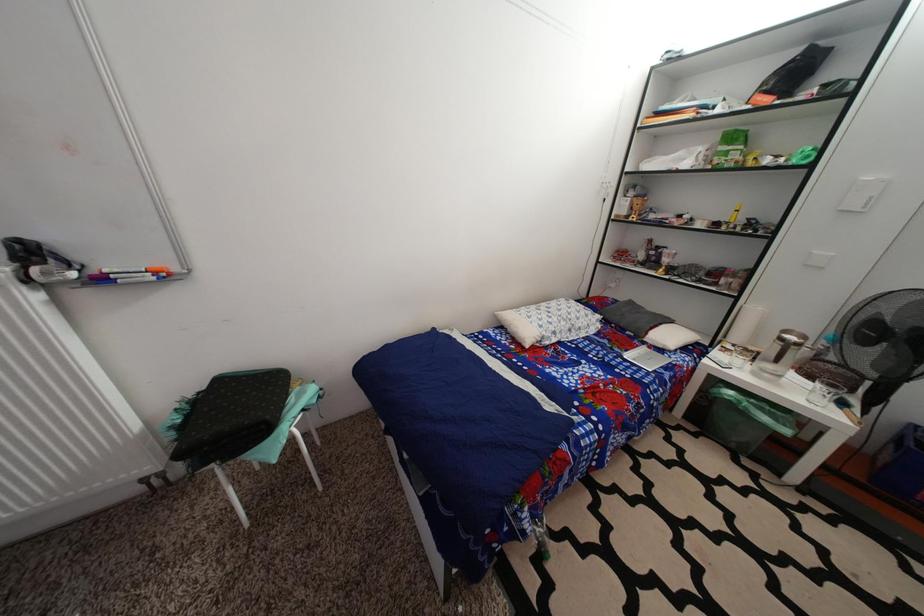
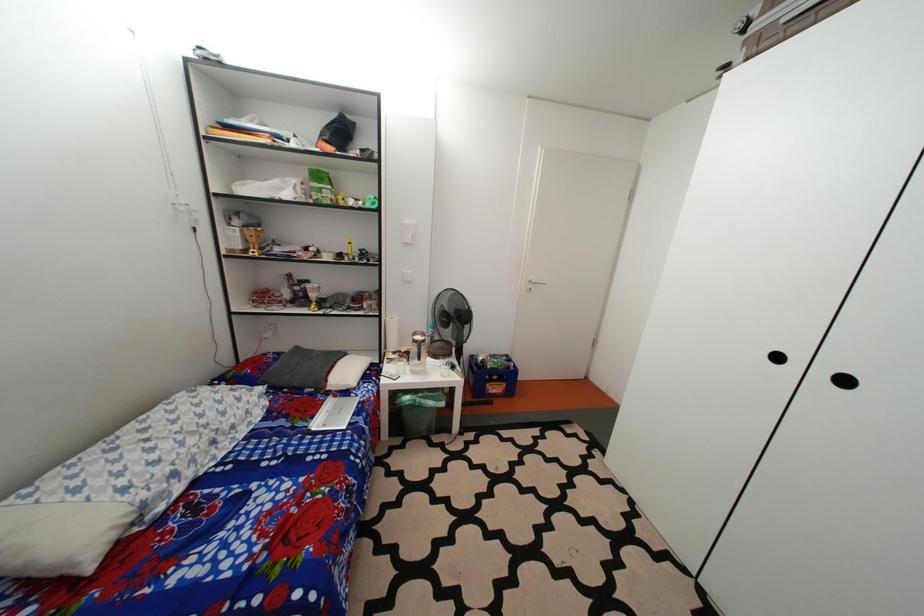
Question: Based on the continuous images, in which direction is the camera rotating? Reply with the corresponding letter.

Choices:
 (A) Left
 (B) Right
 (C) Up
 (D) Down

Answer: (B)